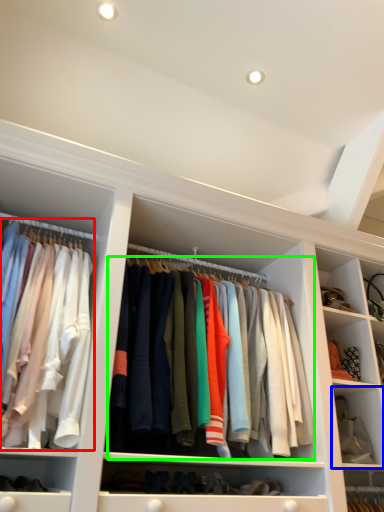
Question: Estimate the real-world distances between objects in this image. Which object is farther from clothing (highlighted by a red box), cabinet (highlighted by a blue box) or clothing (highlighted by a green box)?

Choices:
 (A) cabinet
 (B) clothing

Answer: (A)